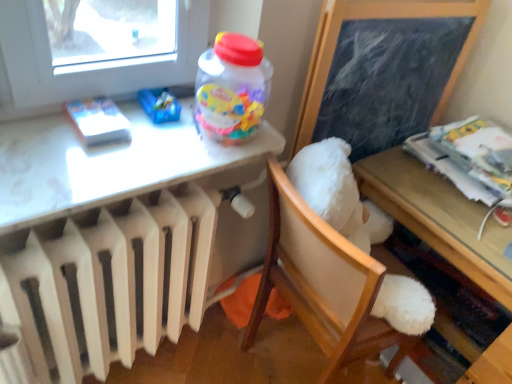
Locate an element on the screen. This screenshot has width=512, height=384. vacant space that is to the left of printed paper stack at right, which ranks as the first magazine in right-to-left order is located at coordinates (397, 174).